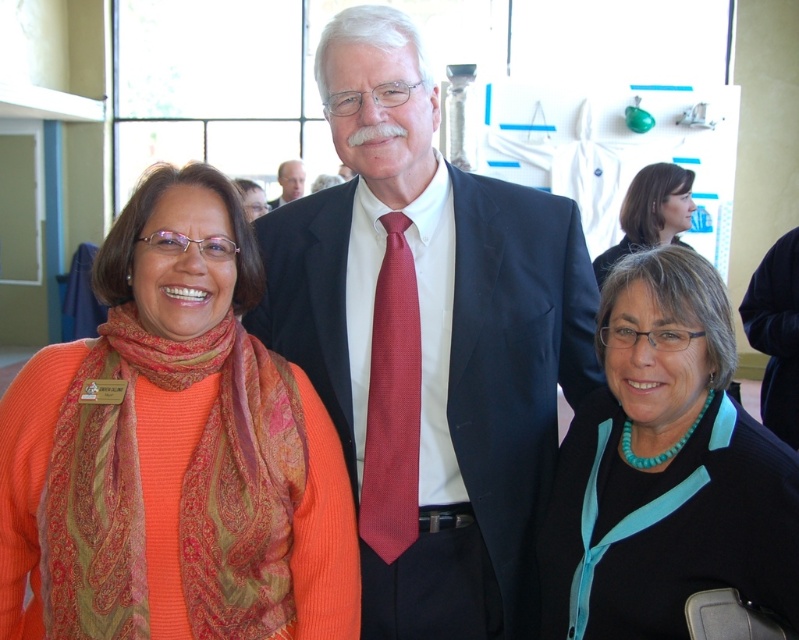
You are a photographer trying to adjust the lighting for a photo shoot. You notice the matte black suit at center and the teal glossy necklace at lower right. Which object should you focus your spotlight on to ensure it reflects light more effectively?

The teal glossy necklace at lower right should be the focus of the spotlight because glossy surfaces reflect light more effectively than matte surfaces like the matte black suit at center.

You are a photographer adjusting the camera settings to capture a group photo. You need to ensure that both the red textured tie at center and the teal fabric blouse at upper right are in focus. Given the distance between them, what is the minimum depth of field required for the camera to keep both subjects sharp?

The minimum depth of field required is at least 8.83 feet to ensure both the red textured tie at center and the teal fabric blouse at upper right are in focus.